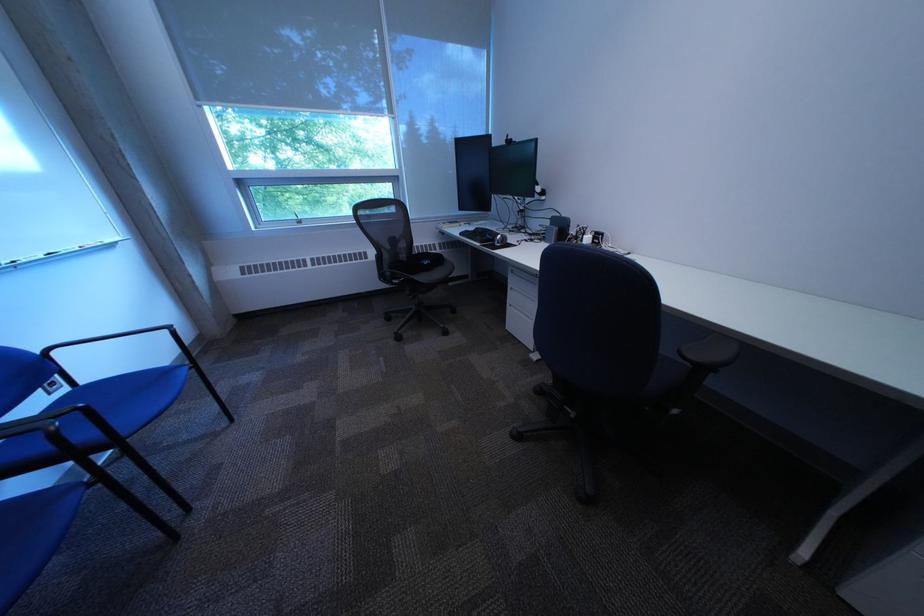
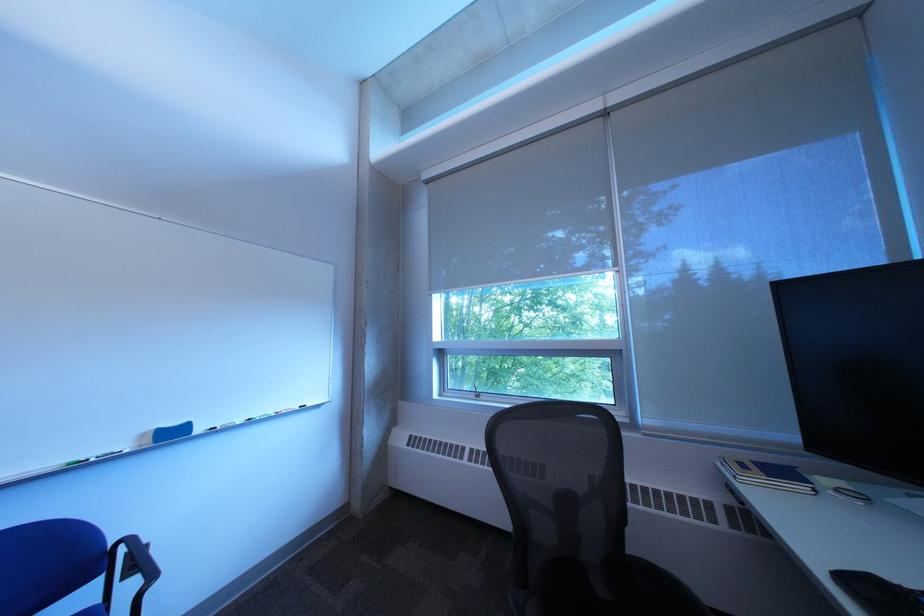
Where in the second image is the point corresponding to the point at 360,102 from the first image?

(611, 267)